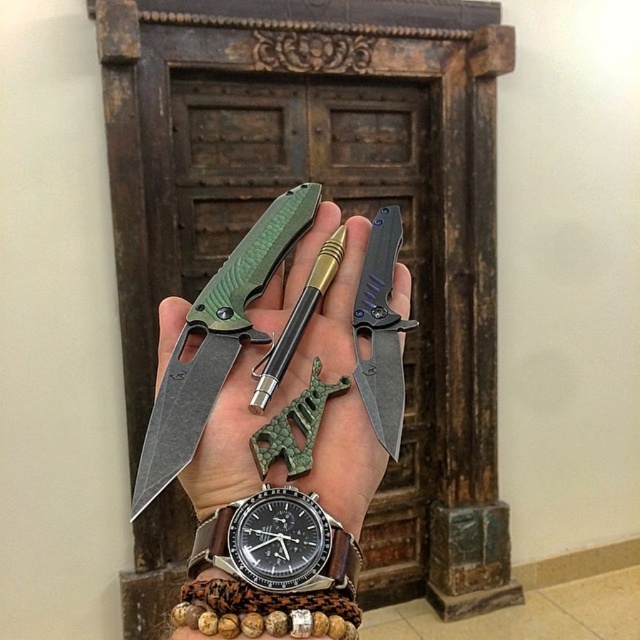
You are an artisan examining the knives and the pen in your hand. You need to place a new decorative sticker exactly at point (289, 403). Which object should you place it on?

The point (289, 403) is on the matte black knife at center, so you should place the sticker on the matte black knife at center.

You are a craftsman trying to fit two knives, the matte black knife at center and the dark gray matte knife at center, into a narrow sheath. Based on their widths, which knife might not fit if the sheath is designed for the narrower one?

The matte black knife at center might not fit into the sheath designed for the narrower dark gray matte knife at center since it might be wider.

You are an artisan working on a detailed carving project. You need to place your matte black knife at center precisely at point 0.630, 0.452 on the wooden door. Can you confirm if the knife is already positioned correctly based on the image?

The matte black knife at center is already positioned at point (289, 403) on the wooden door, so yes, it is correctly placed.